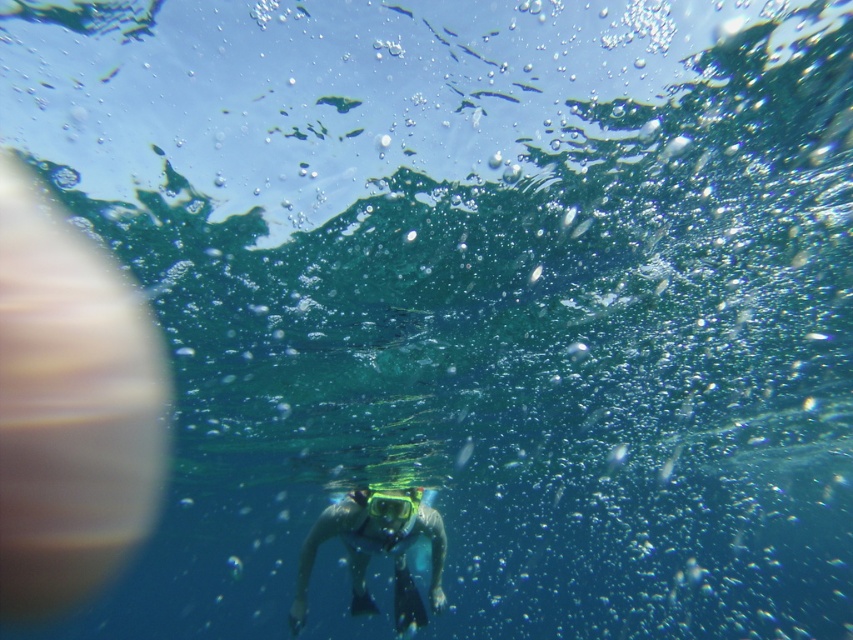
You are a marine biologist observing the underwater scene. You notice the blue matte snorkeling gear at center and the clear plastic goggles at center. Based on their positions, which one is closer to the surface of the water?

The clear plastic goggles at center are closer to the surface of the water because the blue matte snorkeling gear at center is positioned below them.

You are a snorkeler preparing to dive underwater. You notice the blue matte snorkeling gear at center and the clear plastic goggles at center. Which item is positioned to the right when viewed from your perspective?

The clear plastic goggles at center are positioned to the right of the blue matte snorkeling gear at center.

You are a marine biologist observing an underwater scene. You notice the blue matte snorkeling gear at center and the clear plastic goggles at center. Which object is taller?

The blue matte snorkeling gear at center is taller than the clear plastic goggles at center.